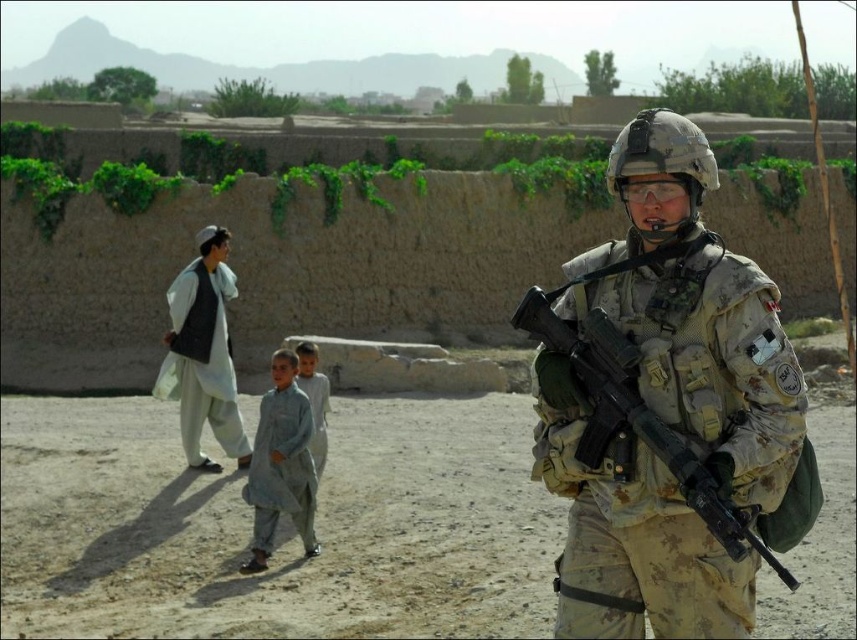
You are a photographer trying to capture the soldier in the foreground and the group of people in the midground. If you focus on the point closer to the camera, which point should you choose between point (36, 502) and point (237, 442)?

You should choose point (36, 502) because it is closer to the camera than point (237, 442).